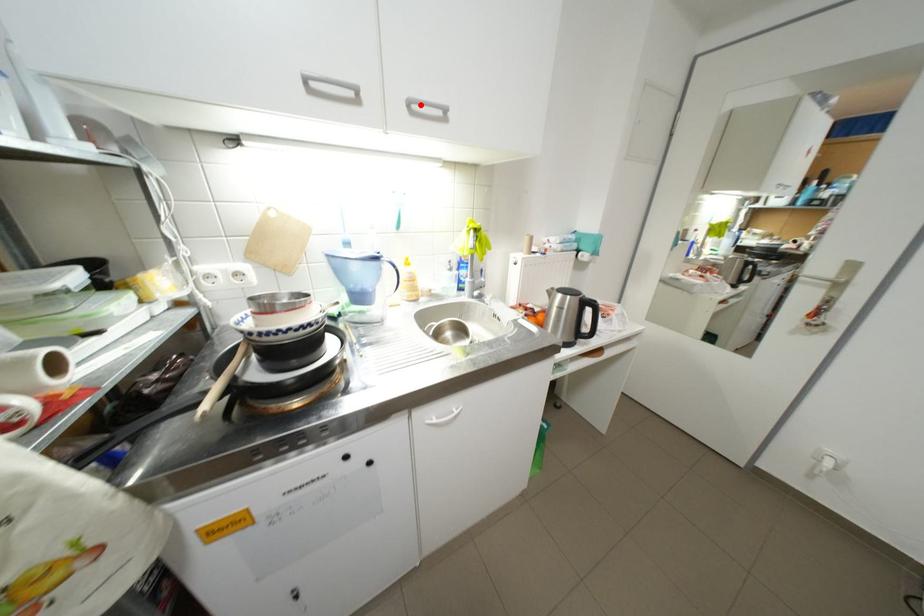
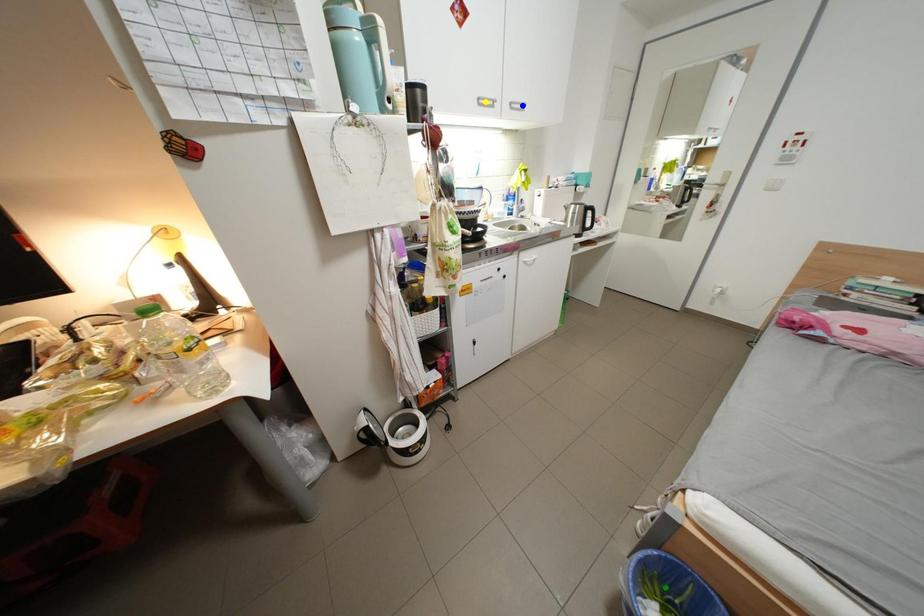
Question: I am providing you with two images of the same scene from different viewpoints. A red point is marked on the first image. You are given multiple points on the second image. Which mark in image 2 goes with the point in image 1?

Choices:
 (A) blue point
 (B) green point
 (C) yellow point

Answer: (A)